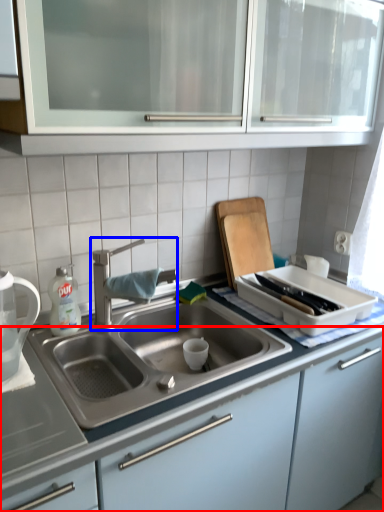
Question: Which object appears closest to the camera in this image, cabinetry (highlighted by a red box) or tap (highlighted by a blue box)?

Choices:
 (A) cabinetry
 (B) tap

Answer: (A)